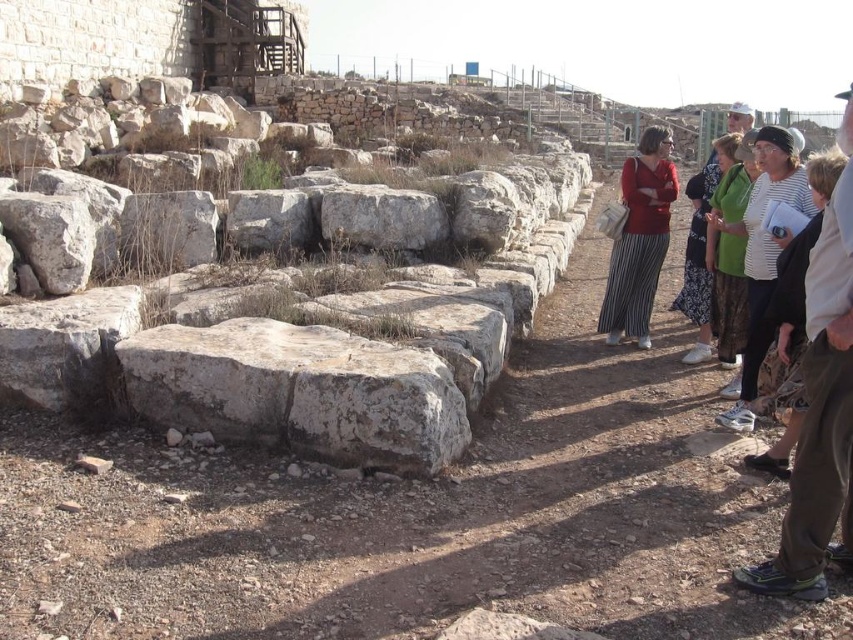
Does striped fabric jacket at right have a lesser width compared to striped fabric at right?

No, striped fabric jacket at right is not thinner than striped fabric at right.

Who is more distant from viewer, (827, 388) or (775, 156)?

Point (775, 156)

At what (x,y) coordinates should I click in order to perform the action: click on striped fabric jacket at right. Please return your answer as a coordinate pair (x, y). Looking at the image, I should click on (820, 410).

Does gray stone boulder at left appear on the left side of striped fabric jacket at right?

Indeed, gray stone boulder at left is positioned on the left side of striped fabric jacket at right.

Which is above, gray stone boulder at left or striped fabric jacket at right?

gray stone boulder at left

You are a GUI agent. You are given a task and a screenshot of the screen. Output one action in this format:
    pyautogui.click(x=<x>, y=<y>)
    Task: Click on the gray stone boulder at left
    
    Given the screenshot: What is the action you would take?
    pyautogui.click(x=318, y=320)

Which is behind, point (303, 429) or point (646, 209)?

Positioned behind is point (646, 209).

Is gray stone boulder at left above red matte sweater at center?

Yes.

Identify the location of gray stone boulder at left. (318, 320).

The image size is (853, 640). What are the coordinates of `gray stone boulder at left` in the screenshot? It's located at (318, 320).